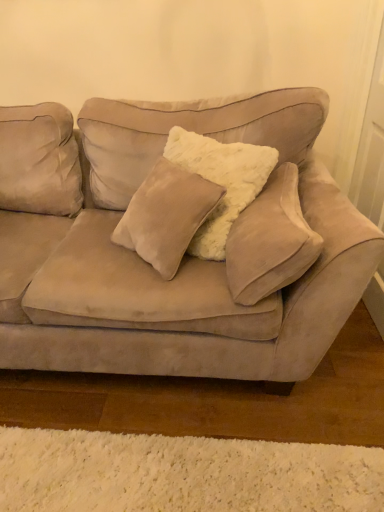
Question: Should I look upward or downward to see suede couch at center?

Choices:
 (A) up
 (B) down

Answer: (A)

Question: From the image's perspective, does white fluffy pillow at center appear lower than suede couch at center?

Choices:
 (A) yes
 (B) no

Answer: (A)

Question: Can you confirm if white fluffy pillow at center is smaller than suede couch at center?

Choices:
 (A) no
 (B) yes

Answer: (B)

Question: Is white fluffy pillow at center wider than suede couch at center?

Choices:
 (A) yes
 (B) no

Answer: (B)

Question: Considering the relative positions of white fluffy pillow at center and suede couch at center in the image provided, is white fluffy pillow at center to the right of suede couch at center from the viewer's perspective?

Choices:
 (A) yes
 (B) no

Answer: (A)

Question: Does white fluffy pillow at center have a greater height compared to suede couch at center?

Choices:
 (A) no
 (B) yes

Answer: (A)

Question: Considering the relative sizes of white fluffy pillow at center and suede couch at center in the image provided, is white fluffy pillow at center bigger than suede couch at center?

Choices:
 (A) yes
 (B) no

Answer: (B)

Question: Is suede couch at center behind white fluffy pillow at center?

Choices:
 (A) yes
 (B) no

Answer: (B)

Question: Is suede couch at center taller than white fluffy pillow at center?

Choices:
 (A) no
 (B) yes

Answer: (B)

Question: Could you tell me if suede couch at center is facing white fluffy pillow at center?

Choices:
 (A) no
 (B) yes

Answer: (B)

Question: From a real-world perspective, is suede couch at center below white fluffy pillow at center?

Choices:
 (A) no
 (B) yes

Answer: (B)

Question: From the image's perspective, is suede couch at center located beneath white fluffy pillow at center?

Choices:
 (A) no
 (B) yes

Answer: (A)

Question: Is suede couch at center shorter than white fluffy pillow at center?

Choices:
 (A) yes
 (B) no

Answer: (B)

Question: Does point (81, 280) appear closer or farther from the camera than point (248, 262)?

Choices:
 (A) farther
 (B) closer

Answer: (A)